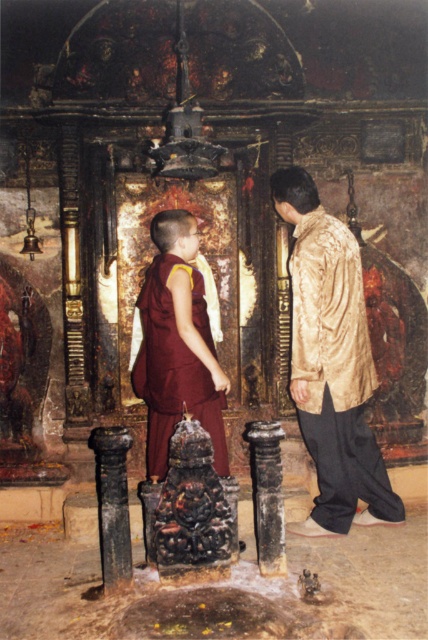
Question: Which object appears closest to the camera in this image?

Choices:
 (A) maroon cotton robe at center
 (B) gold silk robe at right

Answer: (A)

Question: Is gold silk robe at right in front of maroon cotton robe at center?

Choices:
 (A) yes
 (B) no

Answer: (B)

Question: Does gold silk robe at right lie in front of maroon cotton robe at center?

Choices:
 (A) no
 (B) yes

Answer: (A)

Question: Does gold silk robe at right appear on the left side of maroon cotton robe at center?

Choices:
 (A) yes
 (B) no

Answer: (B)

Question: Among these objects, which one is farthest from the camera?

Choices:
 (A) gold silk robe at right
 (B) maroon cotton robe at center

Answer: (A)